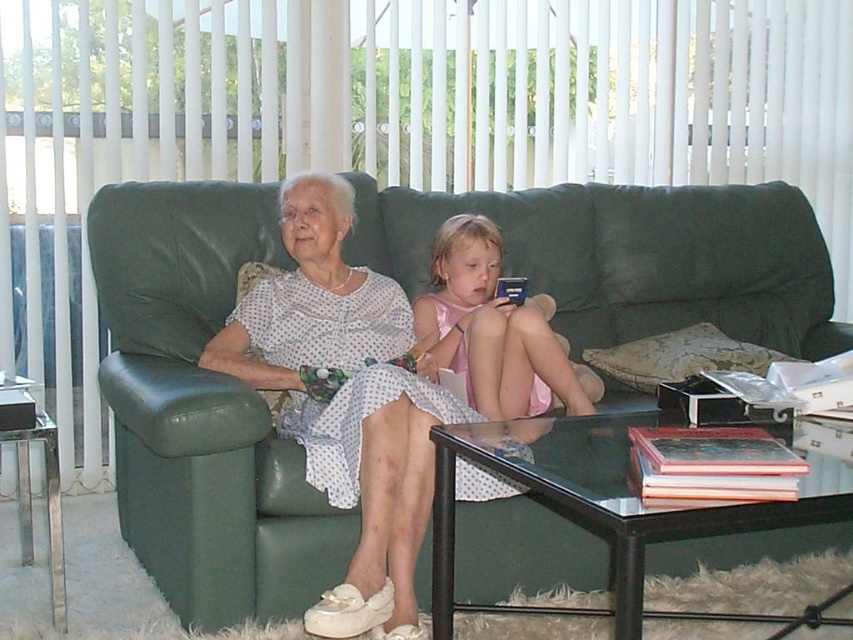
You are planning to pack a suitcase and have both the matte white dress at center and the pink satin dress at center. If you want to maximize space, which dress should you choose to pack first?

The pink satin dress at center should be packed first because it is narrower than the matte white dress at center, allowing more space for the wider dress later.